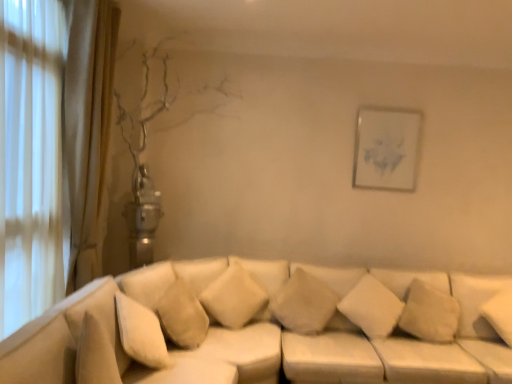
Question: Is white soft pillow at right, which is the 4th pillow from left to right, closer to camera compared to white paper at upper right?

Choices:
 (A) yes
 (B) no

Answer: (A)

Question: Is white soft pillow at right, which is the 4th pillow from left to right, to the right of white paper at upper right from the viewer's perspective?

Choices:
 (A) no
 (B) yes

Answer: (B)

Question: Is white soft pillow at right, which is the 4th pillow from left to right, further to camera compared to white paper at upper right?

Choices:
 (A) yes
 (B) no

Answer: (B)

Question: Is white soft pillow at right, which is the 4th pillow from left to right, outside white paper at upper right?

Choices:
 (A) no
 (B) yes

Answer: (B)

Question: From a real-world perspective, does white soft pillow at right, which is the 1th pillow in right-to-left order, stand above white paper at upper right?

Choices:
 (A) no
 (B) yes

Answer: (A)

Question: Is white soft pillow at right, which is the 1th pillow in right-to-left order, placed right next to white paper at upper right?

Choices:
 (A) yes
 (B) no

Answer: (B)

Question: Is white soft pillow at right, which is the 1th pillow in right-to-left order, oriented towards white soft cushion at center, which ranks as the first pillow in left-to-right order?

Choices:
 (A) no
 (B) yes

Answer: (A)

Question: Can you confirm if white soft pillow at right, which is the 1th pillow in right-to-left order, is smaller than white soft cushion at center, which ranks as the first pillow in left-to-right order?

Choices:
 (A) no
 (B) yes

Answer: (B)

Question: From the image's perspective, is white soft pillow at right, which is the 1th pillow in right-to-left order, beneath white soft cushion at center, the fourth pillow positioned from the right?

Choices:
 (A) no
 (B) yes

Answer: (B)

Question: Can you confirm if white soft pillow at right, which is the 1th pillow in right-to-left order, is thinner than white soft cushion at center, which ranks as the first pillow in left-to-right order?

Choices:
 (A) yes
 (B) no

Answer: (B)

Question: From the image's perspective, would you say white soft pillow at right, which is the 4th pillow from left to right, is positioned over white soft cushion at center, the fourth pillow positioned from the right?

Choices:
 (A) no
 (B) yes

Answer: (A)

Question: Considering the relative sizes of white soft pillow at right, which is the 4th pillow from left to right, and white soft cushion at center, which ranks as the first pillow in left-to-right order, in the image provided, is white soft pillow at right, which is the 4th pillow from left to right, shorter than white soft cushion at center, which ranks as the first pillow in left-to-right order,?

Choices:
 (A) yes
 (B) no

Answer: (A)

Question: Does white soft pillow at center, positioned as the 3th pillow in left-to-right order, appear on the left side of white soft cushion at center, the fourth pillow positioned from the right?

Choices:
 (A) yes
 (B) no

Answer: (B)